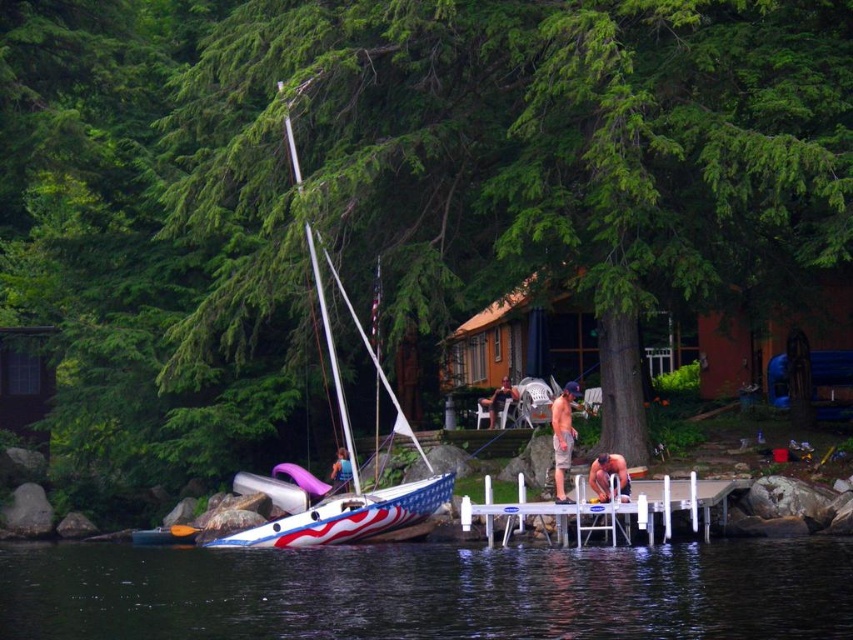
Is the position of transparent water at lower center less distant than that of tan shorts at center?

That is True.

Is transparent water at lower center below tan shorts at center?

Correct, transparent water at lower center is located below tan shorts at center.

Locate an element on the screen. The height and width of the screenshot is (640, 853). transparent water at lower center is located at coordinates (430, 593).

Is american flag painted sailboat at center further to camera compared to smooth white chair at center?

No, it is not.

Is american flag painted sailboat at center below smooth white chair at center?

Correct, american flag painted sailboat at center is located below smooth white chair at center.

You are a GUI agent. You are given a task and a screenshot of the screen. Output one action in this format:
    pyautogui.click(x=<x>, y=<y>)
    Task: Click on the american flag painted sailboat at center
    The image size is (853, 640).
    Given the screenshot: What is the action you would take?
    pyautogui.click(x=347, y=516)

Find the location of a particular element. This screenshot has height=640, width=853. american flag painted sailboat at center is located at coordinates (347, 516).

Which of these two, transparent water at lower center or smooth tan skin at lower right, stands taller?

Standing taller between the two is transparent water at lower center.

The image size is (853, 640). What do you see at coordinates (430, 593) in the screenshot? I see `transparent water at lower center` at bounding box center [430, 593].

This screenshot has height=640, width=853. I want to click on transparent water at lower center, so [x=430, y=593].